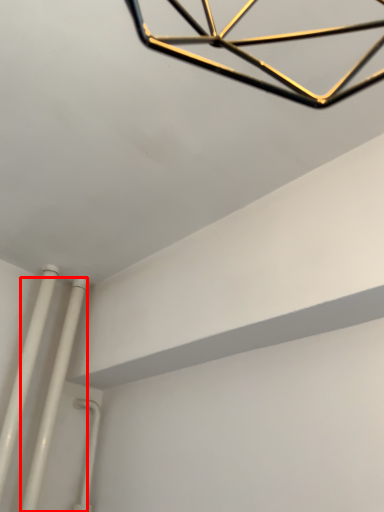
Question: In this image, where is pipe (annotated by the red box) located relative to pipe?

Choices:
 (A) left
 (B) right

Answer: (B)